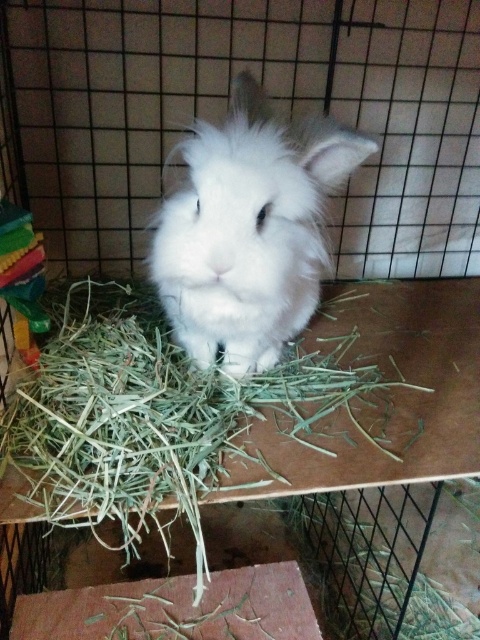
Question: Does green straw at center appear under white fluffy rabbit at center?

Choices:
 (A) no
 (B) yes

Answer: (B)

Question: Can you confirm if green straw at center is positioned below white fluffy rabbit at center?

Choices:
 (A) no
 (B) yes

Answer: (B)

Question: Among these objects, which one is farthest from the camera?

Choices:
 (A) green straw at center
 (B) white fluffy rabbit at center

Answer: (B)

Question: Among these objects, which one is nearest to the camera?

Choices:
 (A) green straw at center
 (B) white fluffy rabbit at center

Answer: (A)

Question: Does green straw at center have a larger size compared to white fluffy rabbit at center?

Choices:
 (A) no
 (B) yes

Answer: (B)

Question: Which of the following is the closest to the observer?

Choices:
 (A) green straw at center
 (B) white fluffy rabbit at center

Answer: (A)